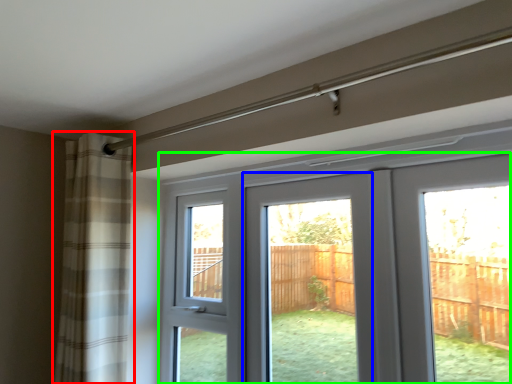
Question: Estimate the real-world distances between objects in this image. Which object is closer to curtain (highlighted by a red box), screen door (highlighted by a blue box) or door (highlighted by a green box)?

Choices:
 (A) screen door
 (B) door

Answer: (A)